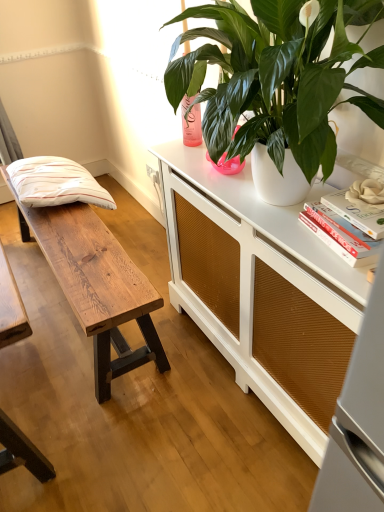
Locate an element on the screen. The height and width of the screenshot is (512, 384). white matte book at upper right, the 1th book ordered from the bottom is located at coordinates (341, 234).

You are a GUI agent. You are given a task and a screenshot of the screen. Output one action in this format:
    pyautogui.click(x=<x>, y=<y>)
    Task: Click on the white textured cabinet at center
    The width and height of the screenshot is (384, 512).
    Given the screenshot: What is the action you would take?
    pyautogui.click(x=262, y=292)

In order to click on wooden bench at left in this screenshot , I will do `click(96, 285)`.

The width and height of the screenshot is (384, 512). I want to click on white matte book at upper right, the first book positioned from the top, so click(x=357, y=213).

Locate an element on the screen. The width and height of the screenshot is (384, 512). white matte book at upper right, the 2th book from the top is located at coordinates (341, 234).

Choose the correct answer: Is wooden bench at left inside white matte book at upper right, the 1th book ordered from the bottom, or outside it?

wooden bench at left lies outside white matte book at upper right, the 1th book ordered from the bottom.

Consider the image. Which object is further away from the camera, wooden bench at left or white matte book at upper right, the 1th book ordered from the bottom?

wooden bench at left is behind.

Is wooden bench at left positioned with its back to white matte book at upper right, the 2th book from the top?

No.

What's the angular difference between wooden bench at left and white matte book at upper right, the 2th book from the top,'s facing directions?

The angle between the facing direction of wooden bench at left and the facing direction of white matte book at upper right, the 2th book from the top, is 8.76 degrees.

From the image's perspective, does white matte flower at upper right appear lower than green glossy leafy plant at upper right?

Yes, from the image's perspective, white matte flower at upper right is beneath green glossy leafy plant at upper right.

Is white matte flower at upper right to the right of green glossy leafy plant at upper right from the viewer's perspective?

Yes.

Who is bigger, white matte flower at upper right or green glossy leafy plant at upper right?

green glossy leafy plant at upper right.

Does white matte flower at upper right have a lesser width compared to green glossy leafy plant at upper right?

Correct, the width of white matte flower at upper right is less than that of green glossy leafy plant at upper right.

Does point (104, 298) appear closer or farther from the camera than point (223, 68)?

Point (104, 298) is positioned farther from the camera compared to point (223, 68).

What's the angular difference between wooden bench at left and green glossy leafy plant at upper right's facing directions?

The facing directions of wooden bench at left and green glossy leafy plant at upper right are 0.58 degrees apart.

Considering the relative sizes of wooden bench at left and green glossy leafy plant at upper right in the image provided, is wooden bench at left thinner than green glossy leafy plant at upper right?

Yes, wooden bench at left is thinner than green glossy leafy plant at upper right.

From the image's perspective, would you say wooden bench at left is shown under green glossy leafy plant at upper right?

Answer: Yes.

Considering the relative sizes of white textured cabinet at center and green glossy leafy plant at upper right in the image provided, is white textured cabinet at center taller than green glossy leafy plant at upper right?

Indeed, white textured cabinet at center has a greater height compared to green glossy leafy plant at upper right.

From a real-world perspective, between white textured cabinet at center and green glossy leafy plant at upper right, who is vertically lower?

white textured cabinet at center, from a real-world perspective.

Which is closer to the camera, (265, 339) or (321, 50)?

The point (321, 50) is closer to the camera.

In the scene shown: In the image, is white textured cabinet at center on the left side or the right side of green glossy leafy plant at upper right?

In the image, white textured cabinet at center appears on the right side of green glossy leafy plant at upper right.

From the image's perspective, is green glossy leafy plant at upper right above white textured cabinet at center?

Indeed, from the image's perspective, green glossy leafy plant at upper right is shown above white textured cabinet at center.

Looking at the image, does green glossy leafy plant at upper right seem bigger or smaller compared to white textured cabinet at center?

In the image, green glossy leafy plant at upper right appears to be smaller than white textured cabinet at center.

Which of these two, green glossy leafy plant at upper right or white textured cabinet at center, stands shorter?

Standing shorter between the two is green glossy leafy plant at upper right.

Is green glossy leafy plant at upper right surrounding white textured cabinet at center?

No, white textured cabinet at center is not inside green glossy leafy plant at upper right.

From a real-world perspective, which object rests below the other?

white textured cabinet at center is physically lower.

Does white matte book at upper right, the 1th book ordered from the bottom, lie behind white textured cabinet at center?

Yes, white matte book at upper right, the 1th book ordered from the bottom, is behind white textured cabinet at center.

Is white matte book at upper right, the 1th book ordered from the bottom, thinner than white textured cabinet at center?

Indeed, white matte book at upper right, the 1th book ordered from the bottom, has a lesser width compared to white textured cabinet at center.

What's the angular difference between wooden bench at left and white matte book at upper right, the 2th book positioned from the bottom,'s facing directions?

4.69 degrees separate the facing orientations of wooden bench at left and white matte book at upper right, the 2th book positioned from the bottom.

From the image's perspective, is wooden bench at left located beneath white matte book at upper right, the first book positioned from the top?

Yes, from the image's perspective, wooden bench at left is below white matte book at upper right, the first book positioned from the top.

Is white matte book at upper right, the 2th book positioned from the bottom, located within wooden bench at left?

No.

From a real-world perspective, who is located lower, wooden bench at left or white matte book at upper right, the 2th book positioned from the bottom?

wooden bench at left.

At what (x,y) coordinates should I click in order to perform the action: click on the 1st book in front of the wooden bench at left. Please return your answer as a coordinate pair (x, y). The height and width of the screenshot is (512, 384). Looking at the image, I should click on (341, 234).

Where is `flower below the green glossy leafy plant at upper right (from a real-world perspective)`? The image size is (384, 512). flower below the green glossy leafy plant at upper right (from a real-world perspective) is located at coordinates (366, 192).

Estimate the real-world distances between objects in this image. Which object is closer to green glossy leafy plant at upper right, wooden bench at left or white matte book at upper right, the 2th book positioned from the bottom?

white matte book at upper right, the 2th book positioned from the bottom, lies closer to green glossy leafy plant at upper right than the other object.

Looking at the image, which one is located closer to white matte book at upper right, the first book positioned from the top, white textured cabinet at center or white matte flower at upper right?

Based on the image, white matte flower at upper right appears to be nearer to white matte book at upper right, the first book positioned from the top.

Based on their spatial positions, is green glossy leafy plant at upper right or white striped pillow at left closer to white matte book at upper right, the 1th book ordered from the bottom?

The object closer to white matte book at upper right, the 1th book ordered from the bottom, is green glossy leafy plant at upper right.

Consider the image. Estimate the real-world distances between objects in this image. Which object is closer to white matte book at upper right, the 1th book ordered from the bottom, white matte flower at upper right or white textured cabinet at center?

white matte flower at upper right is positioned closer to the anchor white matte book at upper right, the 1th book ordered from the bottom.

From the image, which object appears to be nearer to white matte flower at upper right, white striped pillow at left or green glossy leafy plant at upper right?

green glossy leafy plant at upper right.

Consider the image. Looking at the image, which one is located closer to white striped pillow at left, white matte book at upper right, the 1th book ordered from the bottom, or green glossy leafy plant at upper right?

Based on the image, green glossy leafy plant at upper right appears to be nearer to white striped pillow at left.

Looking at the image, which one is located further to wooden bench at left, white textured cabinet at center or white matte book at upper right, the first book positioned from the top?

white matte book at upper right, the first book positioned from the top, is positioned further to the anchor wooden bench at left.

From the image, which object appears to be nearer to white matte book at upper right, the 1th book ordered from the bottom, white striped pillow at left or white matte flower at upper right?

white matte flower at upper right is positioned closer to the anchor white matte book at upper right, the 1th book ordered from the bottom.

Image resolution: width=384 pixels, height=512 pixels. I want to click on flower between green glossy leafy plant at upper right and white textured cabinet at center from top to bottom, so click(x=366, y=192).

Identify the location of table between white striped pillow at left and white matte book at upper right, the 2th book positioned from the bottom, from left to right. click(96, 285).

You are a GUI agent. You are given a task and a screenshot of the screen. Output one action in this format:
    pyautogui.click(x=<x>, y=<y>)
    Task: Click on the book positioned between green glossy leafy plant at upper right and white matte book at upper right, the 1th book ordered from the bottom, from near to far
    
    Given the screenshot: What is the action you would take?
    pyautogui.click(x=357, y=213)

Where is `table between white striped pillow at left and white matte flower at upper right in the horizontal direction`? table between white striped pillow at left and white matte flower at upper right in the horizontal direction is located at coordinates (96, 285).